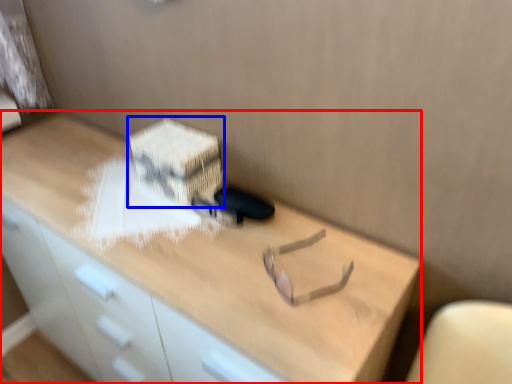
Question: Which point is further to the camera, desk (highlighted by a red box) or cardboard box (highlighted by a blue box)?

Choices:
 (A) desk
 (B) cardboard box

Answer: (B)